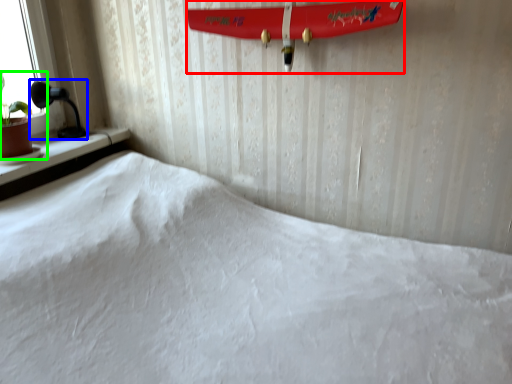
Question: Which object is positioned farthest from surfboard (highlighted by a red box)? Select from table lamp (highlighted by a blue box) and houseplant (highlighted by a green box).

Choices:
 (A) table lamp
 (B) houseplant

Answer: (B)